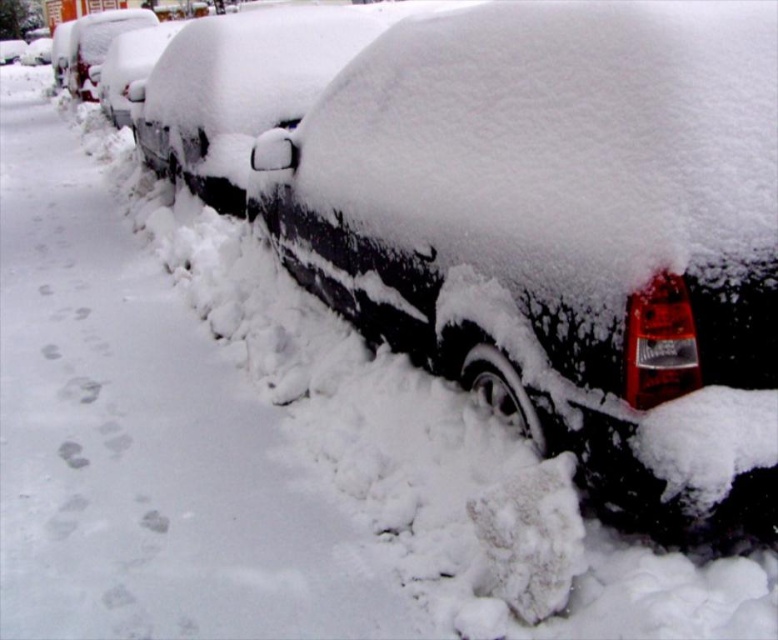
Based on the photo, you are standing on the snowy street and see a black matte car at center. There is a point marked at coordinates (x=563, y=232). Can you determine if this point is located on the car or somewhere else?

The point marked at coordinates (x=563, y=232) is on the black matte car at center.